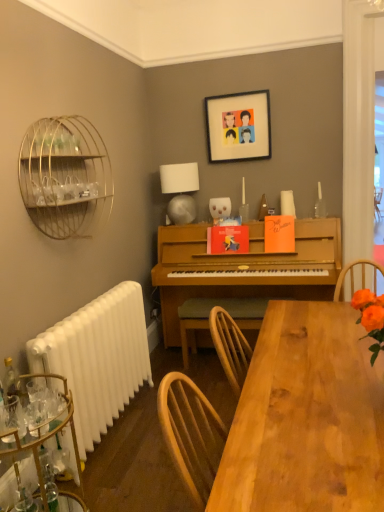
Question: Can you confirm if wooden chair at center is positioned to the right of metallic gold bar cart at lower left?

Choices:
 (A) no
 (B) yes

Answer: (B)

Question: Does wooden chair at center appear on the left side of metallic gold bar cart at lower left?

Choices:
 (A) yes
 (B) no

Answer: (B)

Question: Is wooden chair at center wider than metallic gold bar cart at lower left?

Choices:
 (A) yes
 (B) no

Answer: (B)

Question: Does wooden chair at center have a lesser width compared to metallic gold bar cart at lower left?

Choices:
 (A) no
 (B) yes

Answer: (B)

Question: Is wooden chair at center smaller than metallic gold bar cart at lower left?

Choices:
 (A) yes
 (B) no

Answer: (B)

Question: Does point 211,141 appear closer or farther from the camera than point 369,391?

Choices:
 (A) farther
 (B) closer

Answer: (A)

Question: Considering the positions of matte plastic picture frame at upper center and wooden table at lower center in the image, is matte plastic picture frame at upper center bigger or smaller than wooden table at lower center?

Choices:
 (A) big
 (B) small

Answer: (B)

Question: Is matte plastic picture frame at upper center taller or shorter than wooden table at lower center?

Choices:
 (A) tall
 (B) short

Answer: (A)

Question: Is matte plastic picture frame at upper center situated inside wooden table at lower center or outside?

Choices:
 (A) inside
 (B) outside

Answer: (B)

Question: Is wooden table at lower center wider or thinner than white glossy lampshade at upper center?

Choices:
 (A) thin
 (B) wide

Answer: (B)

Question: Visually, is wooden table at lower center positioned to the left or to the right of white glossy lampshade at upper center?

Choices:
 (A) left
 (B) right

Answer: (B)

Question: Is wooden table at lower center bigger or smaller than white glossy lampshade at upper center?

Choices:
 (A) big
 (B) small

Answer: (A)

Question: In the image, is wooden table at lower center positioned in front of or behind white glossy lampshade at upper center?

Choices:
 (A) behind
 (B) front

Answer: (B)

Question: In terms of width, does white plastic radiator at lower left look wider or thinner when compared to wooden table at lower center?

Choices:
 (A) thin
 (B) wide

Answer: (A)

Question: In terms of height, does white plastic radiator at lower left look taller or shorter compared to wooden table at lower center?

Choices:
 (A) tall
 (B) short

Answer: (A)